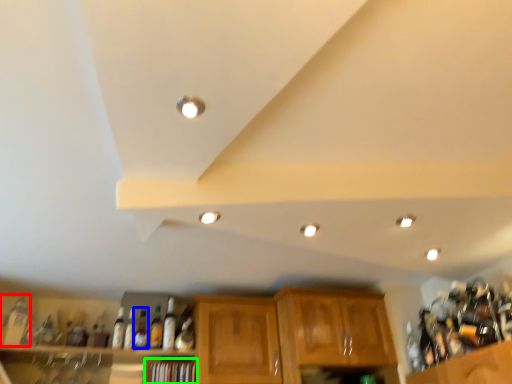
Question: Considering the real-world distances, which object is closest to bottle (highlighted by a red box)? bottle (highlighted by a blue box) or shelf (highlighted by a green box).

Choices:
 (A) bottle
 (B) shelf

Answer: (A)